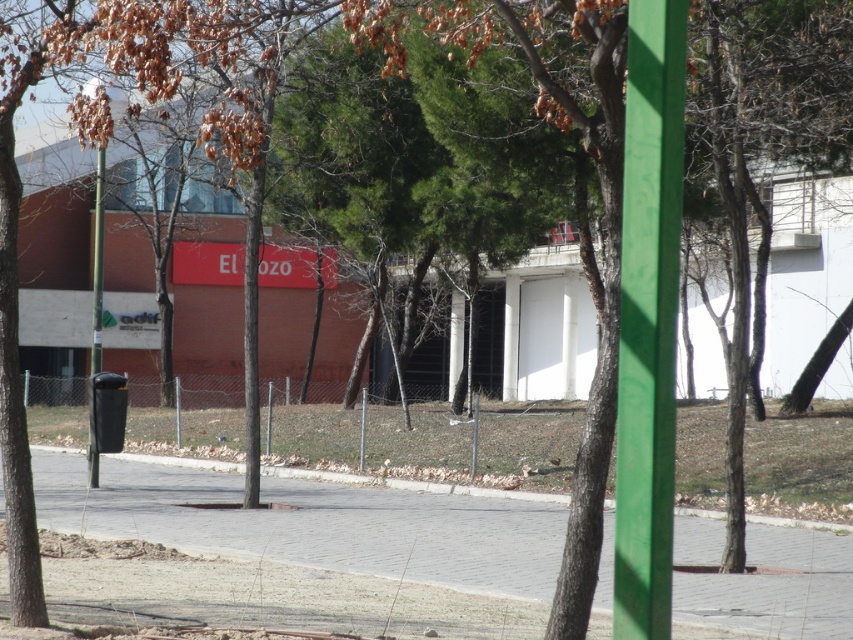
You are standing at the green pole in the right foreground of the image and want to walk towards the building with the reddish brown facade. Which point, point [48,515] or point [630,444], is closer to your current position?

Point [48,515] is closer to your current position at the green pole in the right foreground because it is further to the viewer than point [630,444].